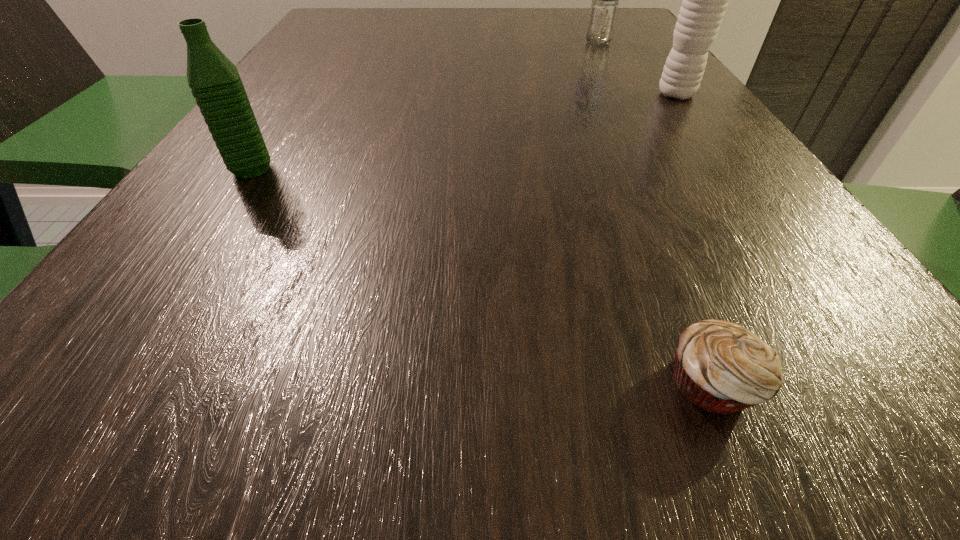
Where is `free spot between the rightmost object and the farthest water bottle`? The height and width of the screenshot is (540, 960). free spot between the rightmost object and the farthest water bottle is located at coordinates (x=637, y=69).

The image size is (960, 540). I want to click on empty location between the second nearest object and the farthest water bottle, so click(425, 106).

Locate an element on the screen. vacant point located between the nearest object and the farthest object is located at coordinates (655, 213).

Image resolution: width=960 pixels, height=540 pixels. I want to click on unoccupied position between the leftmost object and the second nearest water bottle, so click(x=465, y=132).

Where is `object that ranks as the second closest to the rightmost water bottle`? This screenshot has width=960, height=540. object that ranks as the second closest to the rightmost water bottle is located at coordinates (721, 367).

Find the location of `object that is the third closest to the second nearest object`. object that is the third closest to the second nearest object is located at coordinates (603, 11).

Find the location of a particular element. water bottle that stands as the closest to the rightmost object is located at coordinates (603, 11).

Locate an element on the screen. Image resolution: width=960 pixels, height=540 pixels. water bottle that is the nearest to the rightmost water bottle is located at coordinates (603, 11).

This screenshot has height=540, width=960. Identify the location of vacant area in the image that satisfies the following two spatial constraints: 1. on the back side of the nearest object; 2. on the right side of the farthest object. (572, 43).